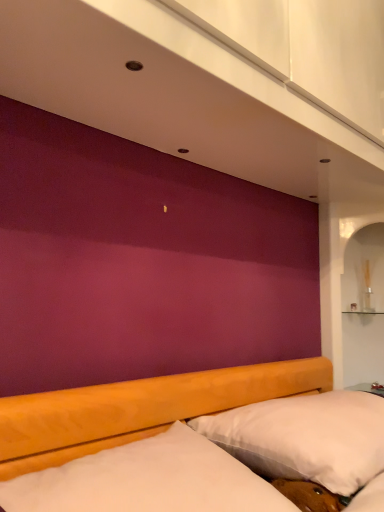
Question: Looking at the image, does metallic silver table at lower right seem bigger or smaller compared to white soft pillow at lower right?

Choices:
 (A) big
 (B) small

Answer: (B)

Question: In terms of height, does metallic silver table at lower right look taller or shorter compared to white soft pillow at lower right?

Choices:
 (A) short
 (B) tall

Answer: (A)

Question: Which is farther from the metallic silver table at lower right?

Choices:
 (A) white soft pillow at lower right
 (B) white soft mattress at lower center

Answer: (B)

Question: Which is nearer to the white soft mattress at lower center?

Choices:
 (A) white soft pillow at lower right
 (B) metallic silver table at lower right

Answer: (A)